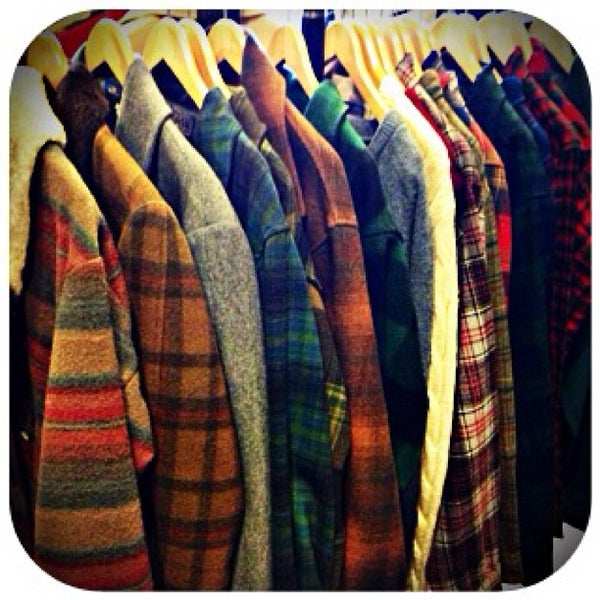
Identify the location of cloth hanger. The height and width of the screenshot is (600, 600). pos(456,46).